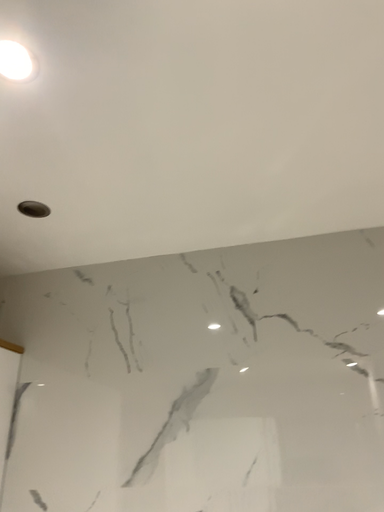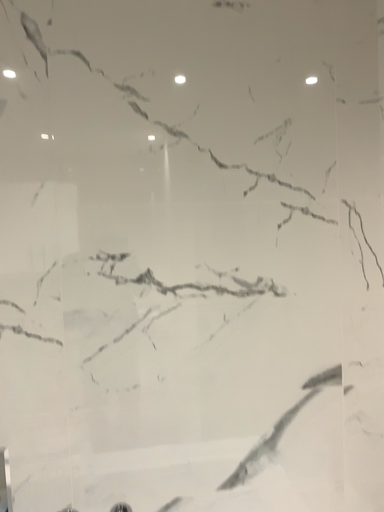
Question: Which way did the camera rotate in the video?

Choices:
 (A) rotated left
 (B) rotated right

Answer: (B)